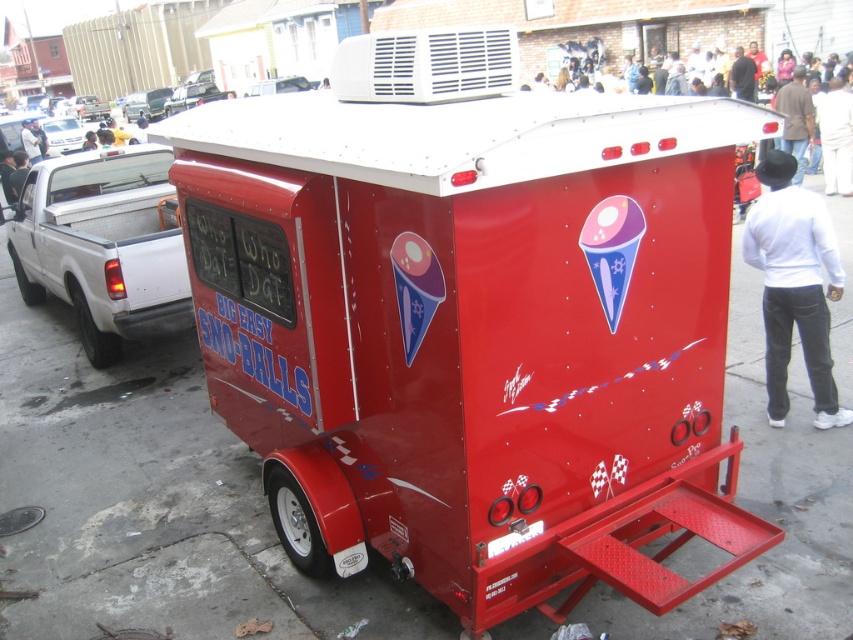
Looking at this image, is shiny red trailer at center to the right of shiny silver car at upper left from the viewer's perspective?

Indeed, shiny red trailer at center is positioned on the right side of shiny silver car at upper left.

Is shiny red trailer at center smaller than shiny silver car at upper left?

Actually, shiny red trailer at center might be larger than shiny silver car at upper left.

What do you see at coordinates (473, 321) in the screenshot?
I see `shiny red trailer at center` at bounding box center [473, 321].

At what (x,y) coordinates should I click in order to perform the action: click on shiny red trailer at center. Please return your answer as a coordinate pair (x, y). Image resolution: width=853 pixels, height=640 pixels. Looking at the image, I should click on click(x=473, y=321).

Which of these two, brown leather jacket at upper right or metallic silver truck at upper left, stands taller?

metallic silver truck at upper left

Between brown leather jacket at upper right and metallic silver truck at upper left, which one appears on the right side from the viewer's perspective?

Positioned to the right is brown leather jacket at upper right.

Is point (791, 93) positioned before point (190, 100)?

Yes, point (791, 93) is closer to viewer.

Where is `brown leather jacket at upper right`? This screenshot has width=853, height=640. brown leather jacket at upper right is located at coordinates (795, 120).

Is point (206, 97) less distant than point (22, 132)?

No.

Which of these two, metallic silver truck at upper left or white shirt at upper center, stands taller?

With more height is white shirt at upper center.

Is point (183, 88) less distant than point (21, 124)?

No, it is not.

At what (x,y) coordinates should I click in order to perform the action: click on metallic silver truck at upper left. Please return your answer as a coordinate pair (x, y). Looking at the image, I should click on (192, 97).